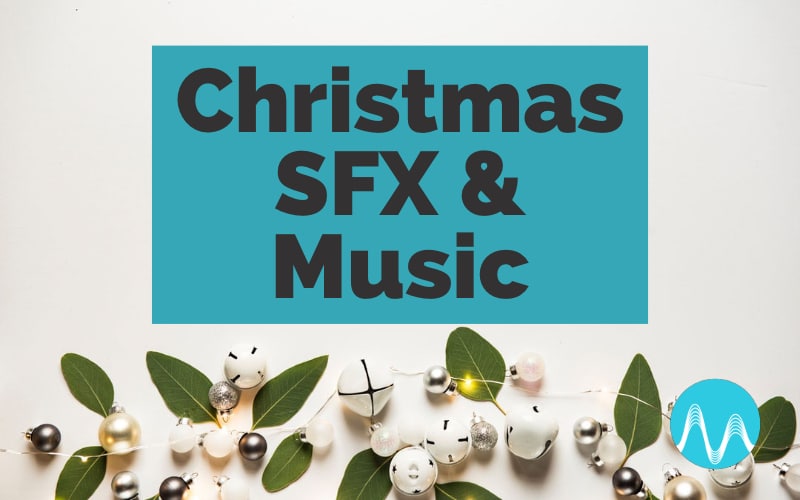
The width and height of the screenshot is (800, 500). In order to click on wall in this screenshot , I will do `click(698, 180)`.